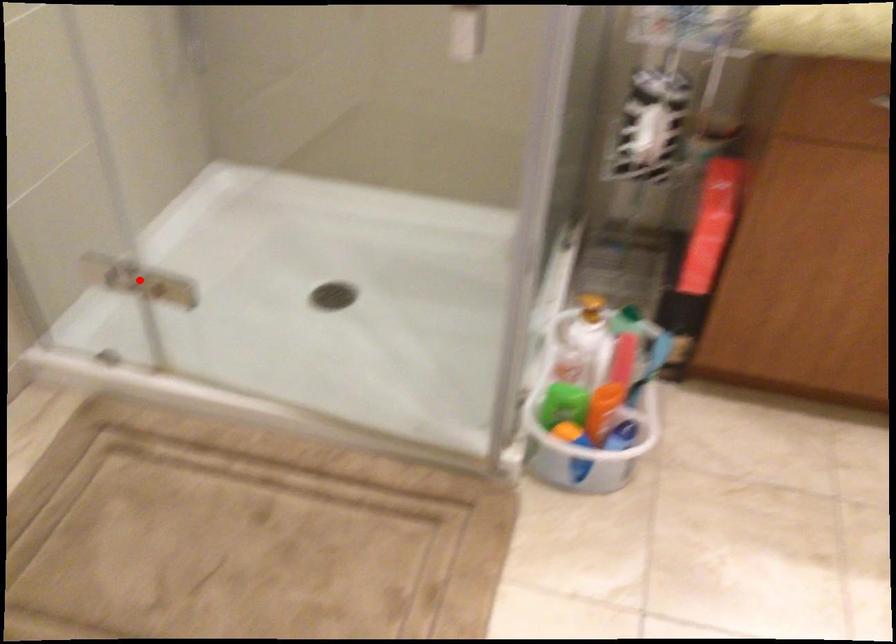
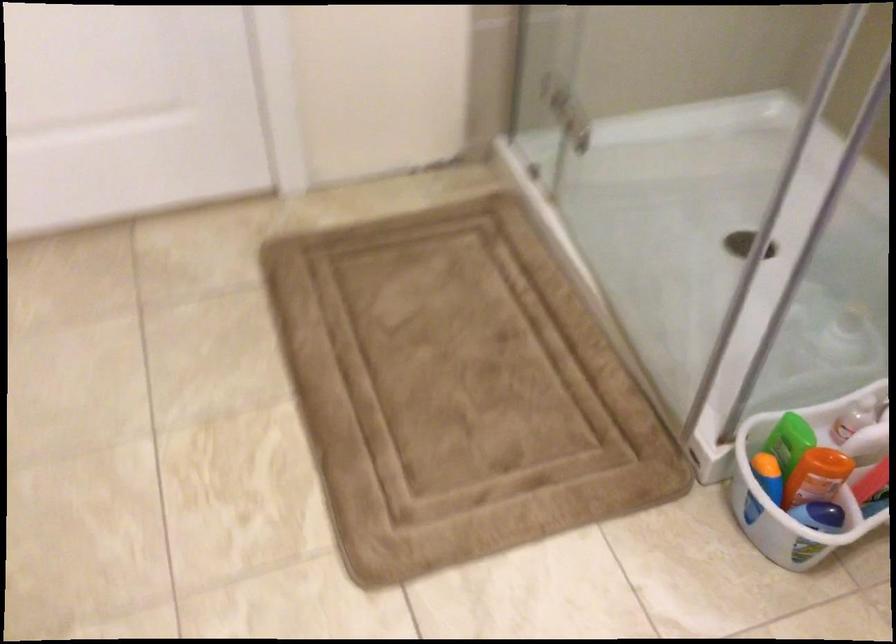
Question: A red point is marked in image1. In image2, is the corresponding 3D point closer to the camera or farther? Reply with the corresponding letter.

Choices:
 (A) The corresponding 3D point is closer.
 (B) The corresponding 3D point is farther.

Answer: (B)